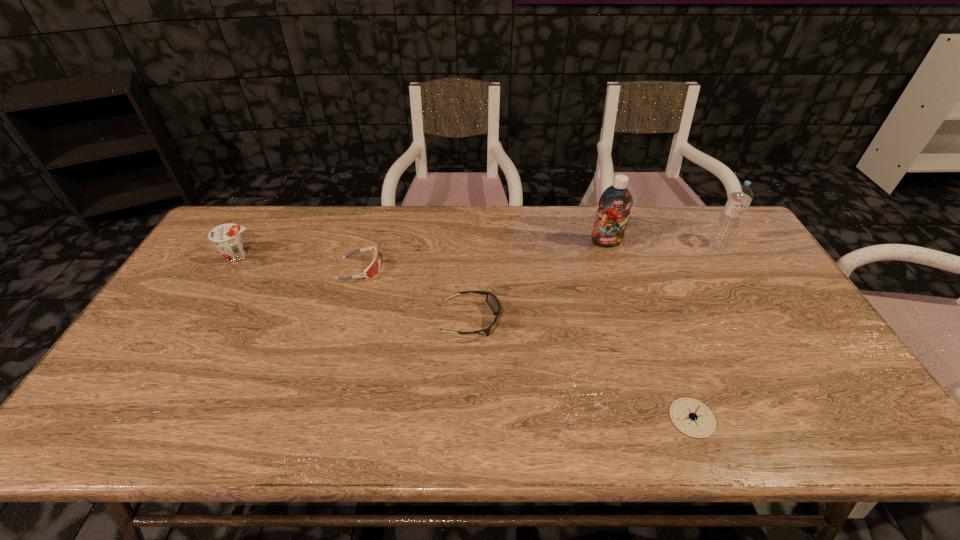
At what (x,y) coordinates should I click in order to perform the action: click on empty space between the fifth object from right to left and the shampoo. Please return your answer as a coordinate pair (x, y). The width and height of the screenshot is (960, 540). Looking at the image, I should click on (483, 255).

This screenshot has height=540, width=960. What are the coordinates of `vacant point located between the compass and the left goggles` in the screenshot? It's located at (526, 343).

This screenshot has width=960, height=540. In order to click on vacant space in between the leftmost object and the nearer goggles in this screenshot , I will do `click(354, 288)`.

Where is `vacant space that's between the shampoo and the fifth object from right to left`? vacant space that's between the shampoo and the fifth object from right to left is located at coordinates (483, 255).

Identify the location of free space between the left goggles and the second nearest object. (416, 294).

This screenshot has width=960, height=540. In order to click on empty space between the compass and the right goggles in this screenshot , I will do `click(582, 369)`.

Where is `object that is the third closest one to the left goggles`? object that is the third closest one to the left goggles is located at coordinates (614, 204).

Identify which object is the second nearest to the rightmost object. Please provide its 2D coordinates. Your answer should be formatted as a tuple, i.e. [(x, y)], where the tuple contains the x and y coordinates of a point satisfying the conditions above.

[(692, 417)]

You are a GUI agent. You are given a task and a screenshot of the screen. Output one action in this format:
    pyautogui.click(x=<x>, y=<y>)
    Task: Click on the free location that satisfies the following two spatial constraints: 1. on the front side of the rightmost object; 2. on the front-facing side of the farther goggles
    
    Given the screenshot: What is the action you would take?
    pyautogui.click(x=734, y=268)

This screenshot has height=540, width=960. Find the location of `vacant space that satisfies the following two spatial constraints: 1. on the lenses of the nearer goggles; 2. on the right side of the nearest object`. vacant space that satisfies the following two spatial constraints: 1. on the lenses of the nearer goggles; 2. on the right side of the nearest object is located at coordinates (x=468, y=418).